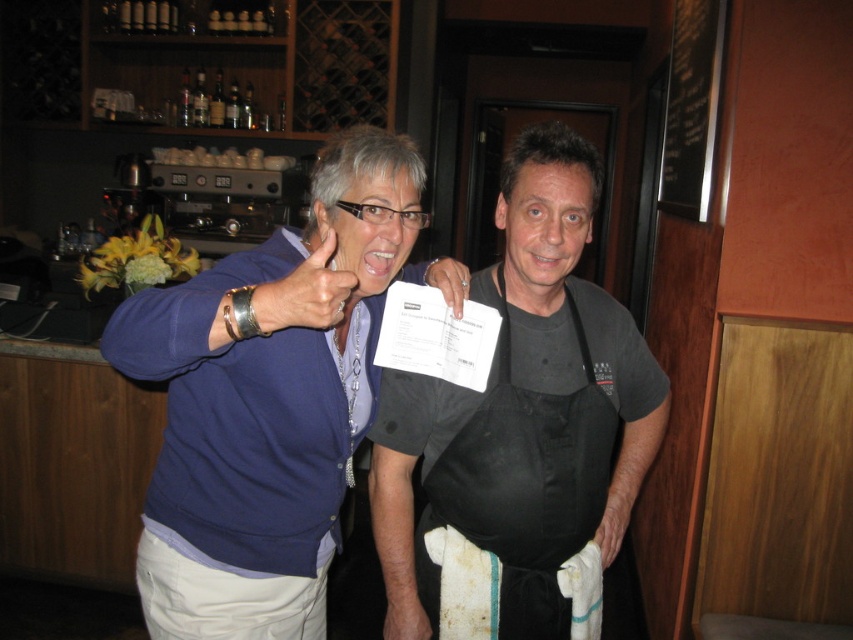
Question: Which of the following is the closest to the observer?

Choices:
 (A) smooth skin hand at center
 (B) matte gold ring at upper center
 (C) blue sweater at upper left
 (D) matte black apron at center

Answer: (C)

Question: In this image, where is black matte apron at center located relative to matte gold ring at upper center?

Choices:
 (A) left
 (B) right

Answer: (B)

Question: In this image, where is matte gold ring at upper center located relative to matte black apron at center?

Choices:
 (A) right
 (B) left

Answer: (B)

Question: Which point appears farthest from the camera in this image?

Choices:
 (A) (367, 346)
 (B) (624, 458)
 (C) (605, 449)

Answer: (B)

Question: From the image, what is the correct spatial relationship of blue sweater at upper left in relation to smooth skin hand at center?

Choices:
 (A) above
 (B) below

Answer: (A)

Question: Considering the real-world distances, which object is farthest from the white matte towel at lower center?

Choices:
 (A) matte black apron at center
 (B) black fabric apron at center
 (C) blue sweater at upper left

Answer: (C)